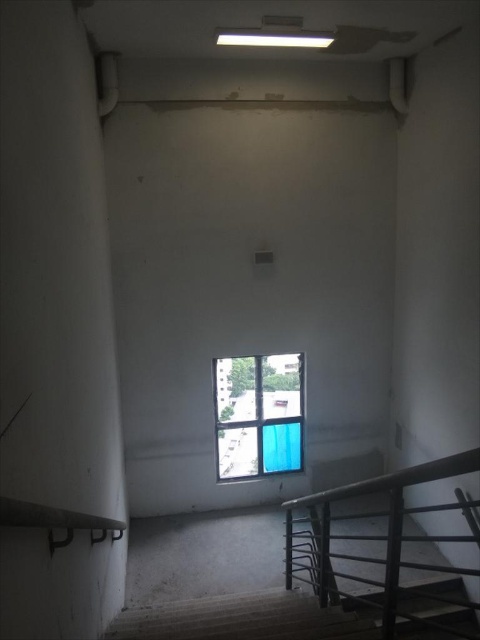
Does metallic gray balustrade at lower right have a smaller size compared to blue fabric curtain at center?

No.

Does metallic gray balustrade at lower right have a larger size compared to blue fabric curtain at center?

Yes.

Is point (367, 483) positioned after point (292, 381)?

No, (367, 483) is in front of (292, 381).

This screenshot has width=480, height=640. I want to click on metallic gray balustrade at lower right, so click(388, 550).

Image resolution: width=480 pixels, height=640 pixels. Describe the element at coordinates (253, 618) in the screenshot. I see `smooth concrete stairs at lower right` at that location.

Does smooth concrete stairs at lower right have a lesser width compared to blue fabric curtain at center?

Incorrect, smooth concrete stairs at lower right's width is not less than blue fabric curtain at center's.

Between point (403, 602) and point (300, 371), which one is positioned in front?

Point (403, 602) is in front.

Identify the location of smooth concrete stairs at lower right. (253, 618).

Can you confirm if metallic gray balustrade at lower right is positioned below smooth concrete stairs at lower right?

No.

Is point (377, 605) positioned before point (122, 625)?

Yes.

Find the location of a particular element. This screenshot has height=640, width=480. metallic gray balustrade at lower right is located at coordinates (388, 550).